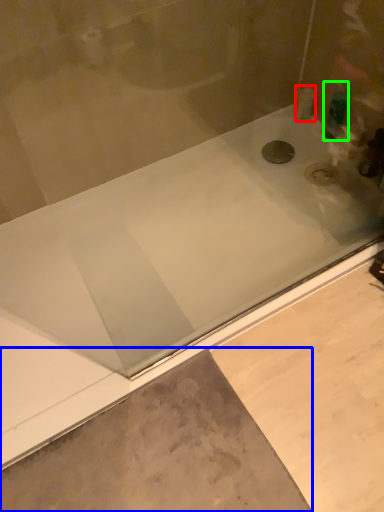
Question: Estimate the real-world distances between objects in this image. Which object is farther from toiletry (highlighted by a red box), concrete (highlighted by a blue box) or toiletry (highlighted by a green box)?

Choices:
 (A) concrete
 (B) toiletry

Answer: (A)